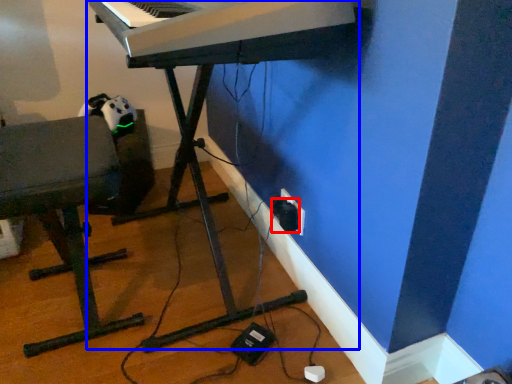
Question: Which point is further to the camera, plug (highlighted by a red box) or piano (highlighted by a blue box)?

Choices:
 (A) plug
 (B) piano

Answer: (A)